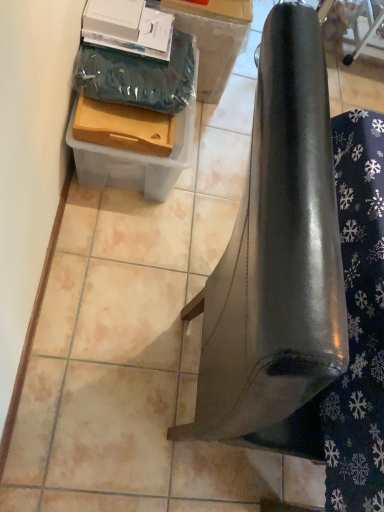
Locate an element on the screen. Image resolution: width=384 pixels, height=512 pixels. free location in front of glossy metallic punching bag at right is located at coordinates (152, 465).